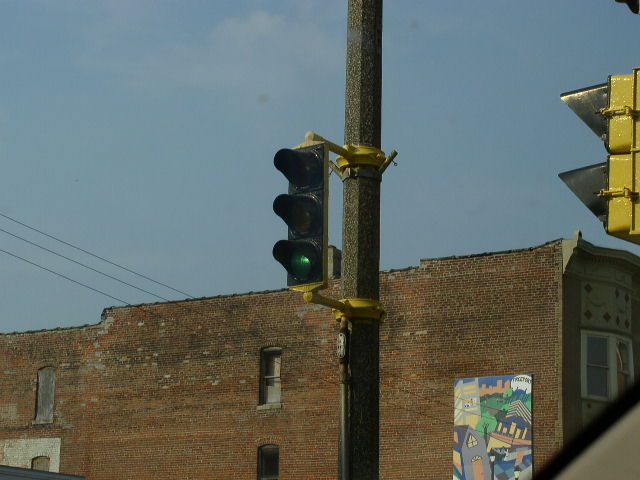
Locate an element on the screen. This screenshot has height=480, width=640. green light is located at coordinates (303, 265).